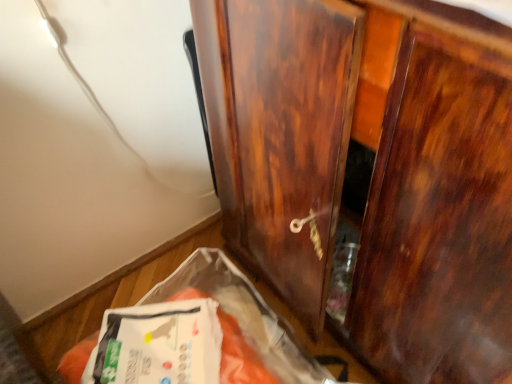
This screenshot has width=512, height=384. What do you see at coordinates (199, 334) in the screenshot? I see `white plastic bag at lower left` at bounding box center [199, 334].

Where is `white plastic bag at lower left`? The height and width of the screenshot is (384, 512). white plastic bag at lower left is located at coordinates (199, 334).

At what (x,y) coordinates should I click in order to perform the action: click on glossy wood cupboard at center. Please return your answer as a coordinate pair (x, y). Looking at the image, I should click on (374, 171).

Describe the element at coordinates (374, 171) in the screenshot. I see `glossy wood cupboard at center` at that location.

You are a GUI agent. You are given a task and a screenshot of the screen. Output one action in this format:
    pyautogui.click(x=<x>, y=<y>)
    Task: Click on the white plastic bag at lower left
    
    Given the screenshot: What is the action you would take?
    pyautogui.click(x=199, y=334)

Which object is positioned more to the left, white plastic bag at lower left or glossy wood cupboard at center?

white plastic bag at lower left is more to the left.

Considering their positions, is white plastic bag at lower left located in front of or behind glossy wood cupboard at center?

Clearly, white plastic bag at lower left is behind glossy wood cupboard at center.

Between point (150, 362) and point (373, 296), which one is positioned behind?

The point (373, 296) is farther from the camera.

From the image's perspective, is white plastic bag at lower left above glossy wood cupboard at center?

Incorrect, from the image's perspective, white plastic bag at lower left is lower than glossy wood cupboard at center.

From a real-world perspective, is white plastic bag at lower left below glossy wood cupboard at center?

Indeed, from a real-world perspective, white plastic bag at lower left is positioned beneath glossy wood cupboard at center.

Is white plastic bag at lower left wider or thinner than glossy wood cupboard at center?

Clearly, white plastic bag at lower left has less width compared to glossy wood cupboard at center.

Does white plastic bag at lower left have a greater height compared to glossy wood cupboard at center?

In fact, white plastic bag at lower left may be shorter than glossy wood cupboard at center.

Does white plastic bag at lower left have a larger size compared to glossy wood cupboard at center?

Incorrect, white plastic bag at lower left is not larger than glossy wood cupboard at center.

Can glossy wood cupboard at center be found inside white plastic bag at lower left?

That's incorrect, glossy wood cupboard at center is not inside white plastic bag at lower left.

Can you see white plastic bag at lower left touching glossy wood cupboard at center?

No.

Could you tell me if white plastic bag at lower left is turned towards glossy wood cupboard at center?

No, white plastic bag at lower left is not turned towards glossy wood cupboard at center.

Measure the distance between white plastic bag at lower left and glossy wood cupboard at center.

They are 14.68 inches apart.

In order to click on waste that appears below the glossy wood cupboard at center (from a real-world perspective) in this screenshot , I will do `click(199, 334)`.

Considering the relative positions of glossy wood cupboard at center and white plastic bag at lower left in the image provided, is glossy wood cupboard at center to the left or to the right of white plastic bag at lower left?

From the image, it's evident that glossy wood cupboard at center is to the right of white plastic bag at lower left.

Is the depth of glossy wood cupboard at center greater than that of white plastic bag at lower left?

That is False.

Is point (236, 33) closer or farther from the camera than point (218, 381)?

Point (236, 33).

From the picture: From the image's perspective, which is below, glossy wood cupboard at center or white plastic bag at lower left?

From the image's view, white plastic bag at lower left is below.

From a real-world perspective, which object rests below the other?

white plastic bag at lower left is physically lower.

Can you confirm if glossy wood cupboard at center is wider than white plastic bag at lower left?

Indeed, glossy wood cupboard at center has a greater width compared to white plastic bag at lower left.

Which of these two, glossy wood cupboard at center or white plastic bag at lower left, stands shorter?

white plastic bag at lower left is shorter.

Considering the sizes of objects glossy wood cupboard at center and white plastic bag at lower left in the image provided, who is bigger, glossy wood cupboard at center or white plastic bag at lower left?

glossy wood cupboard at center is bigger.

Is glossy wood cupboard at center positioned beyond the bounds of white plastic bag at lower left?

Absolutely, glossy wood cupboard at center is external to white plastic bag at lower left.

Is glossy wood cupboard at center next to white plastic bag at lower left?

There is a gap between glossy wood cupboard at center and white plastic bag at lower left.

Could you tell me if glossy wood cupboard at center is turned towards white plastic bag at lower left?

Yes, glossy wood cupboard at center faces towards white plastic bag at lower left.

How many degrees apart are the facing directions of glossy wood cupboard at center and white plastic bag at lower left?

They differ by 91.6 degrees in their facing directions.

Image resolution: width=512 pixels, height=384 pixels. I want to click on cupboard on the right of the white plastic bag at lower left, so click(x=374, y=171).

Where is `cupboard above the white plastic bag at lower left (from a real-world perspective)`? cupboard above the white plastic bag at lower left (from a real-world perspective) is located at coordinates (374, 171).

You are a GUI agent. You are given a task and a screenshot of the screen. Output one action in this format:
    pyautogui.click(x=<x>, y=<y>)
    Task: Click on the waste located underneath the glossy wood cupboard at center (from a real-world perspective)
    The image size is (512, 384).
    Given the screenshot: What is the action you would take?
    pyautogui.click(x=199, y=334)